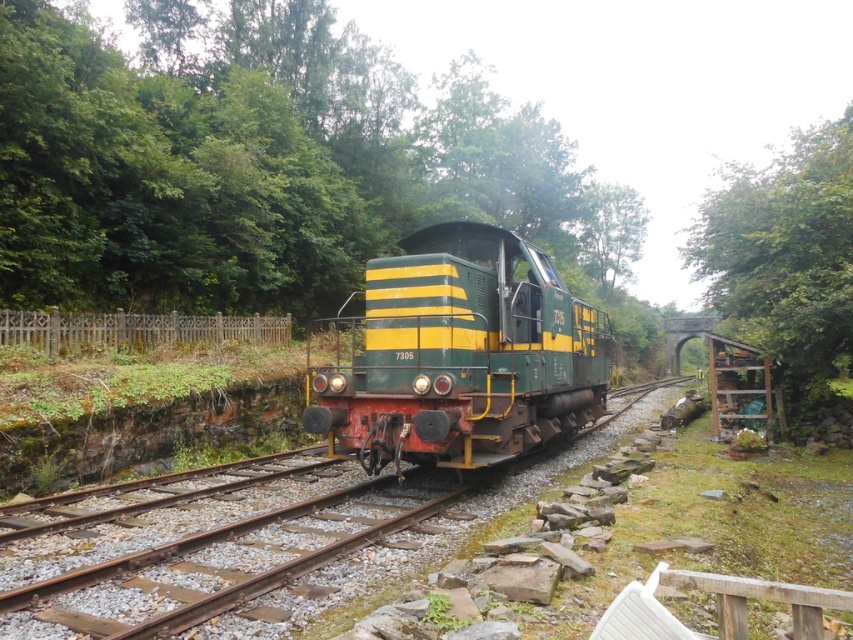
You are standing at the point marked by the coordinates point (248, 544). Looking around, you see the green yellow locomotive at center. What is the nearest object to your current position?

The nearest object to your current position at point (248, 544) is the green yellow locomotive at center, as the point marks its location.